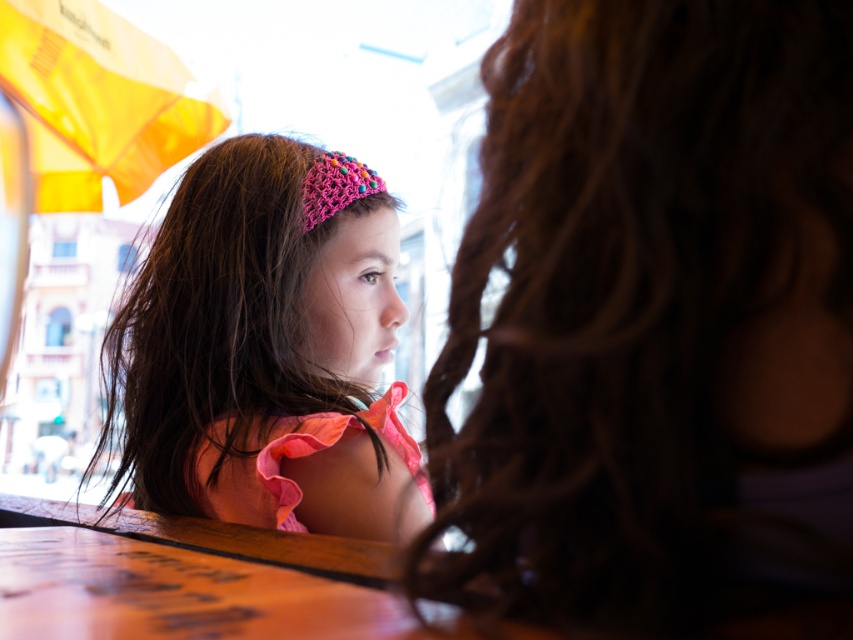
You are a photographer trying to frame a shot of the dark brown curly hair at upper right and the pink knitted headband at upper center. Which object should you adjust your camera angle to focus on first if you want to capture the wider object?

The dark brown curly hair at upper right is wider than the pink knitted headband at upper center, so you should focus on the dark brown curly hair at upper right first to capture its width properly.